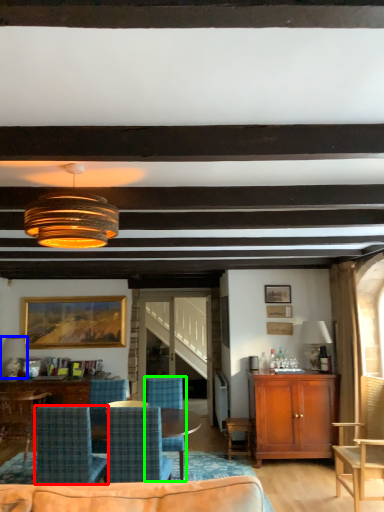
Question: Which object is the farthest from chair (highlighted by a red box)? Choose among these: lamp (highlighted by a blue box) or chair (highlighted by a green box).

Choices:
 (A) lamp
 (B) chair

Answer: (A)